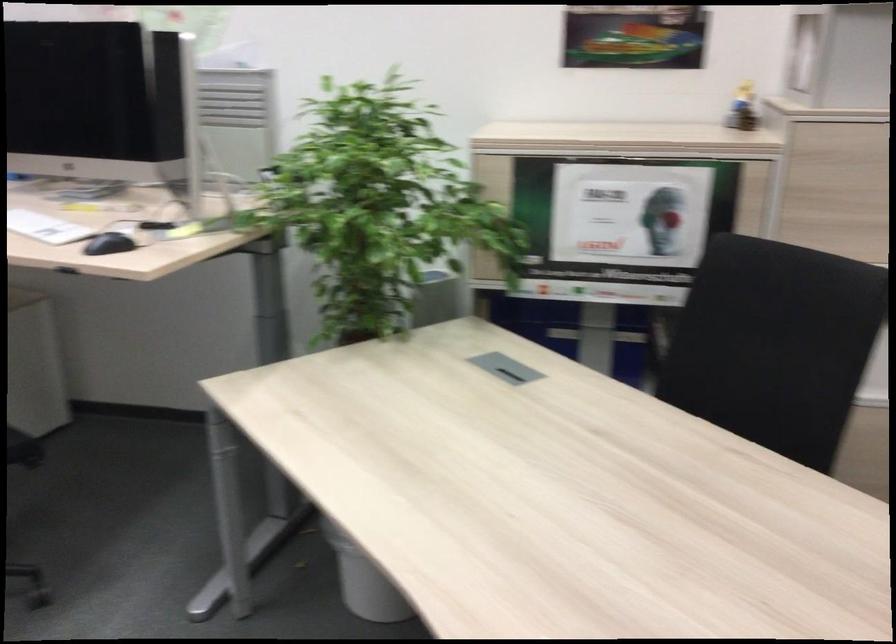
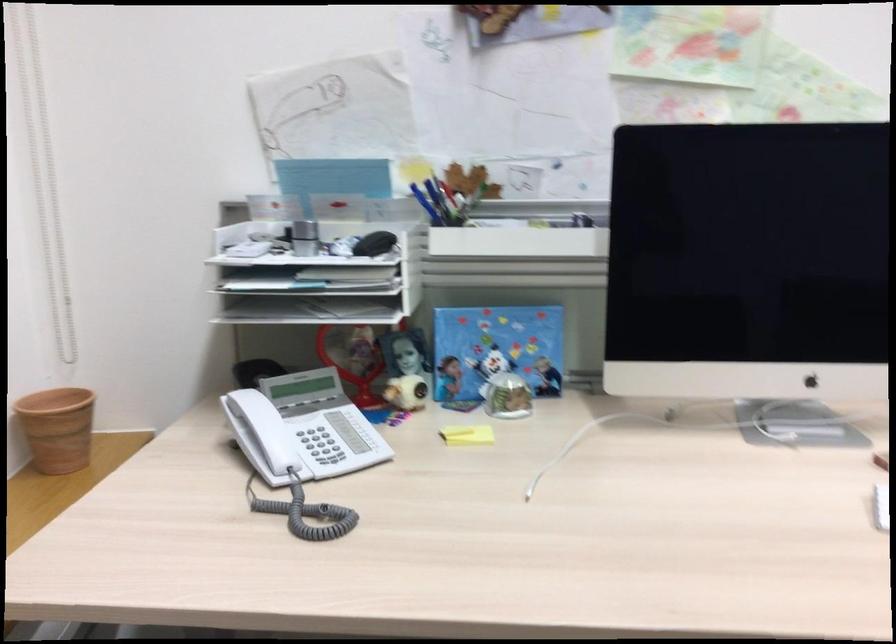
The images are taken continuously from a first-person perspective. In which direction are you moving?

The cameraman moved toward left, forward.